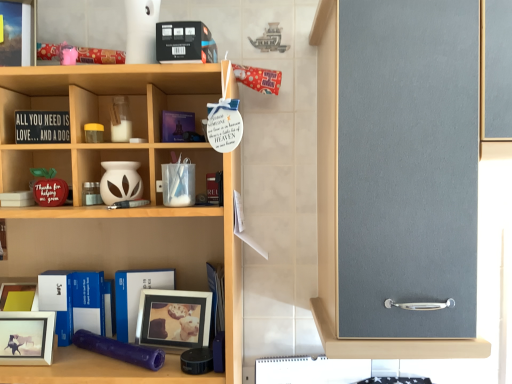
Identify the location of matte purple book at center, the fourth book ordered from the bottom. (177, 126).

The height and width of the screenshot is (384, 512). Describe the element at coordinates (115, 174) in the screenshot. I see `white ceramic vase at center` at that location.

Describe the element at coordinates (74, 302) in the screenshot. I see `blue matte book at lower left, positioned as the 6th book in top-to-bottom order` at that location.

The height and width of the screenshot is (384, 512). What do you see at coordinates (217, 297) in the screenshot?
I see `blue hardcover book at center, marked as the 3th book in a bottom-to-top arrangement` at bounding box center [217, 297].

Locate an element on the screen. The width and height of the screenshot is (512, 384). wooden shelf at center is located at coordinates (120, 209).

Locate an element on the screen. matte purple book at center, the fourth book ordered from the bottom is located at coordinates (177, 126).

Is wooden shelf at center thinner than blue hardcover book at center, marked as the 3th book in a bottom-to-top arrangement?

Incorrect, the width of wooden shelf at center is not less than that of blue hardcover book at center, marked as the 3th book in a bottom-to-top arrangement.

Is wooden shelf at center inside the boundaries of blue hardcover book at center, marked as the 3th book in a bottom-to-top arrangement, or outside?

wooden shelf at center is not inside blue hardcover book at center, marked as the 3th book in a bottom-to-top arrangement, it's outside.

Can you confirm if wooden shelf at center is shorter than blue hardcover book at center, marked as the 3th book in a bottom-to-top arrangement?

No.

Considering the positions of objects wooden shelf at center and blue hardcover book at center, which appears as the 4th book when viewed from the top, in the image provided, who is more to the left, wooden shelf at center or blue hardcover book at center, which appears as the 4th book when viewed from the top,?

Positioned to the left is wooden shelf at center.

Do you think wooden shelf at center is within black matte book at upper center, placed as the 6th book when sorted from bottom to top, or outside of it?

wooden shelf at center is outside black matte book at upper center, placed as the 6th book when sorted from bottom to top.

From the image's perspective, is wooden shelf at center above or below black matte book at upper center, placed as the 6th book when sorted from bottom to top?

wooden shelf at center is below black matte book at upper center, placed as the 6th book when sorted from bottom to top.

From a real-world perspective, is wooden shelf at center positioned over black matte book at upper center, the first book positioned from the top, based on gravity?

No, from a real-world perspective, wooden shelf at center is not on top of black matte book at upper center, the first book positioned from the top.

From the image's perspective, which is above, white ceramic vase at center or matte purple book at center, arranged as the 3th book when viewed from the top?

matte purple book at center, arranged as the 3th book when viewed from the top, is shown above in the image.

Image resolution: width=512 pixels, height=384 pixels. What are the coordinates of `the 1st book positioned above the white ceramic vase at center (from a real-world perspective)` in the screenshot? It's located at click(x=177, y=126).

Could you tell me if white ceramic vase at center is facing matte purple book at center, arranged as the 3th book when viewed from the top?

No, white ceramic vase at center is not facing towards matte purple book at center, arranged as the 3th book when viewed from the top.

From the picture: Could you measure the distance between white ceramic vase at center and matte purple book at center, the fourth book ordered from the bottom?

white ceramic vase at center is 6.34 inches away from matte purple book at center, the fourth book ordered from the bottom.

Are white matte picture frame at lower left, the first picture frame positioned from the left, and black matte book at upper center, placed as the 6th book when sorted from bottom to top, making contact?

They are not placed beside each other.

Between white matte picture frame at lower left, placed as the 2th picture frame when sorted from back to front, and black matte book at upper center, placed as the 6th book when sorted from bottom to top, which one has smaller width?

Thinner between the two is white matte picture frame at lower left, placed as the 2th picture frame when sorted from back to front.

Considering the positions of objects white matte picture frame at lower left, the 1th picture frame from the front, and black matte book at upper center, placed as the 6th book when sorted from bottom to top, in the image provided, who is in front, white matte picture frame at lower left, the 1th picture frame from the front, or black matte book at upper center, placed as the 6th book when sorted from bottom to top,?

black matte book at upper center, placed as the 6th book when sorted from bottom to top, is more forward.

Could you tell me if white matte picture frame at lower left, placed as the 2th picture frame when sorted from back to front, is turned towards blue matte book at lower left, which ranks as the first book in bottom-to-top order?

No, white matte picture frame at lower left, placed as the 2th picture frame when sorted from back to front, is not facing towards blue matte book at lower left, which ranks as the first book in bottom-to-top order.

From the image's perspective, who appears lower, white matte picture frame at lower left, the first picture frame positioned from the left, or blue matte book at lower left, positioned as the 6th book in top-to-bottom order?

white matte picture frame at lower left, the first picture frame positioned from the left, is shown below in the image.

Which of these two, white matte picture frame at lower left, the 1th picture frame from the front, or blue matte book at lower left, which ranks as the first book in bottom-to-top order, is bigger?

white matte picture frame at lower left, the 1th picture frame from the front.

Does white matte picture frame at lower left, placed as the 2th picture frame when sorted from back to front, have a lesser width compared to blue matte book at lower left, which ranks as the first book in bottom-to-top order?

No.

Is wooden picture frame at lower center, the first picture frame when ordered from right to left, located within blue hardcover book at center, placed as the 2th book when sorted from bottom to top?

That's incorrect, wooden picture frame at lower center, the first picture frame when ordered from right to left, is not inside blue hardcover book at center, placed as the 2th book when sorted from bottom to top.

Does blue hardcover book at center, placed as the 2th book when sorted from bottom to top, touch wooden picture frame at lower center, which appears as the 2th picture frame when viewed from the left?

Yes, the surface of blue hardcover book at center, placed as the 2th book when sorted from bottom to top, is in contact with wooden picture frame at lower center, which appears as the 2th picture frame when viewed from the left.

Looking at the image, does blue hardcover book at center, which is the fifth book from top to bottom, seem bigger or smaller compared to wooden picture frame at lower center, the first picture frame when ordered from right to left?

In the image, blue hardcover book at center, which is the fifth book from top to bottom, appears to be smaller than wooden picture frame at lower center, the first picture frame when ordered from right to left.

Is blue hardcover book at center, which is the fifth book from top to bottom, thinner than wooden picture frame at lower center, which ranks as the 1th picture frame in back-to-front order?

Yes.

Could you tell me if matte black signboard at left, which appears as the 2th book when viewed from the top, is turned towards black matte book at upper center, placed as the 6th book when sorted from bottom to top?

No, matte black signboard at left, which appears as the 2th book when viewed from the top, is not oriented towards black matte book at upper center, placed as the 6th book when sorted from bottom to top.

From a real-world perspective, is matte black signboard at left, which appears as the 2th book when viewed from the top, located higher than black matte book at upper center, placed as the 6th book when sorted from bottom to top?

No, from a real-world perspective, matte black signboard at left, which appears as the 2th book when viewed from the top, is not above black matte book at upper center, placed as the 6th book when sorted from bottom to top.

Would you consider matte black signboard at left, which ranks as the fifth book in bottom-to-top order, to be distant from black matte book at upper center, the first book positioned from the top?

matte black signboard at left, which ranks as the fifth book in bottom-to-top order, is actually quite close to black matte book at upper center, the first book positioned from the top.

At what (x,y) coordinates should I click in order to perform the action: click on the 1st book directly beneath the wooden shelf at center (from a real-world perspective). Please return your answer as a coordinate pair (x, y). Looking at the image, I should click on (217, 297).

From the image's perspective, count 3rd books upward from the wooden shelf at center and point to it. Please provide its 2D coordinates.

[(185, 43)]

Looking at the image, which one is located further to wooden shelf at center, wooden picture frame at lower center, which ranks as the 1th picture frame in back-to-front order, or blue hardcover book at center, which appears as the 4th book when viewed from the top?

blue hardcover book at center, which appears as the 4th book when viewed from the top.

Based on their spatial positions, is white matte picture frame at lower left, placed as the 2th picture frame when sorted from back to front, or black matte book at upper center, the first book positioned from the top, further from wooden picture frame at lower center, the 2th picture frame when ordered from front to back?

Among the two, black matte book at upper center, the first book positioned from the top, is located further to wooden picture frame at lower center, the 2th picture frame when ordered from front to back.

Which object lies nearer to the anchor point wooden picture frame at lower center, the 2th picture frame when ordered from front to back, blue matte book at lower left, which ranks as the first book in bottom-to-top order, or blue hardcover book at center, which is the fifth book from top to bottom?

blue hardcover book at center, which is the fifth book from top to bottom.

Estimate the real-world distances between objects in this image. Which object is further from blue hardcover book at center, marked as the 3th book in a bottom-to-top arrangement, wooden shelf at center or wooden picture frame at lower center, the 2th picture frame when ordered from front to back?

Among the two, wooden shelf at center is located further to blue hardcover book at center, marked as the 3th book in a bottom-to-top arrangement.

When comparing their distances from wooden shelf at center, does wooden picture frame at lower center, which appears as the 2th picture frame when viewed from the left, or blue hardcover book at center, which is the fifth book from top to bottom, seem further?

wooden picture frame at lower center, which appears as the 2th picture frame when viewed from the left, is positioned further to the anchor wooden shelf at center.

Looking at the image, which one is located closer to blue matte book at lower left, positioned as the 6th book in top-to-bottom order, blue hardcover book at center, placed as the 2th book when sorted from bottom to top, or matte purple book at center, the fourth book ordered from the bottom?

blue hardcover book at center, placed as the 2th book when sorted from bottom to top, is closer to blue matte book at lower left, positioned as the 6th book in top-to-bottom order.

Based on their spatial positions, is wooden shelf at center or matte purple book at center, the fourth book ordered from the bottom, further from blue hardcover book at center, which is the fifth book from top to bottom?

matte purple book at center, the fourth book ordered from the bottom, is positioned further to the anchor blue hardcover book at center, which is the fifth book from top to bottom.

Based on their spatial positions, is blue matte book at lower left, which ranks as the first book in bottom-to-top order, or wooden picture frame at lower center, the 2th picture frame when ordered from front to back, further from black matte book at upper center, the first book positioned from the top?

blue matte book at lower left, which ranks as the first book in bottom-to-top order, is positioned further to the anchor black matte book at upper center, the first book positioned from the top.

Where is `cabinet between matte purple book at center, arranged as the 3th book when viewed from the top, and wooden picture frame at lower center, the 2th picture frame when ordered from front to back, in the vertical direction`? The image size is (512, 384). cabinet between matte purple book at center, arranged as the 3th book when viewed from the top, and wooden picture frame at lower center, the 2th picture frame when ordered from front to back, in the vertical direction is located at coordinates (115, 174).

Where is `shelf that lies between matte purple book at center, arranged as the 3th book when viewed from the top, and white matte picture frame at lower left, placed as the 2th picture frame when sorted from back to front, from top to bottom`? The height and width of the screenshot is (384, 512). shelf that lies between matte purple book at center, arranged as the 3th book when viewed from the top, and white matte picture frame at lower left, placed as the 2th picture frame when sorted from back to front, from top to bottom is located at coordinates (120, 209).

The image size is (512, 384). I want to click on cabinet between matte purple book at center, arranged as the 3th book when viewed from the top, and wooden shelf at center, in the vertical direction, so click(x=115, y=174).

Identify the location of shelf between white ceramic vase at center and blue hardcover book at center, marked as the 3th book in a bottom-to-top arrangement, in the vertical direction. This screenshot has width=512, height=384. (120, 209).